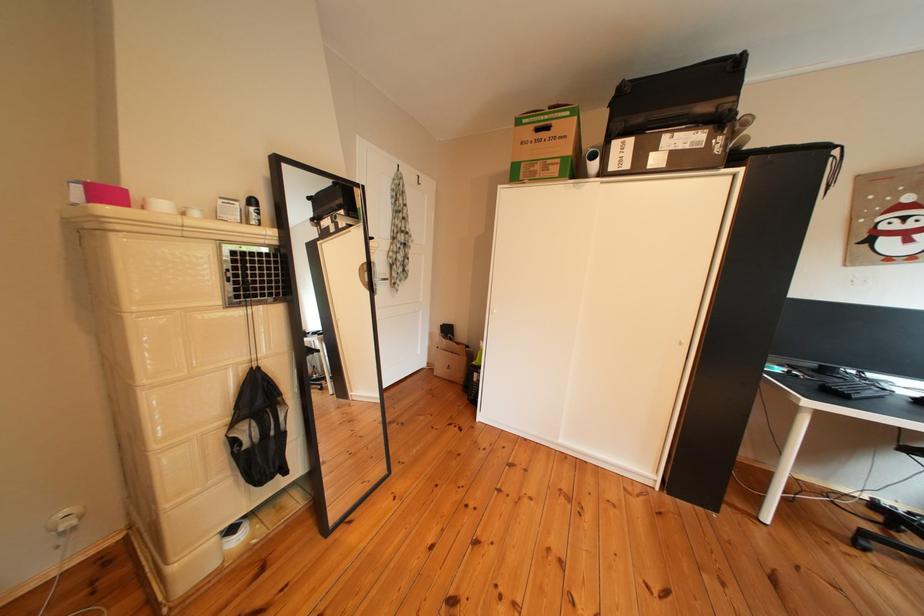
The image size is (924, 616). In order to click on large cardboard box in this screenshot , I will do `click(545, 145)`.